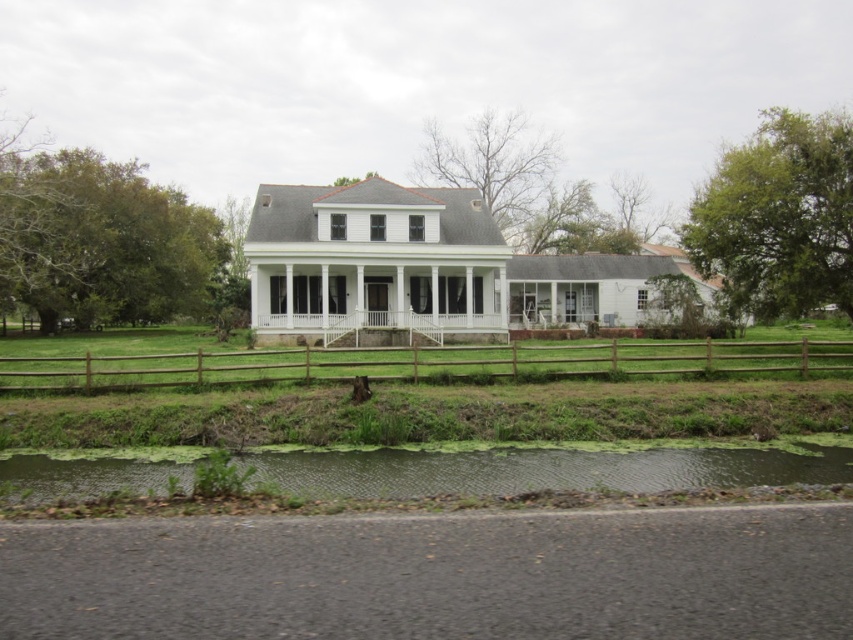
You are standing on the paved road in front of the house. You want to cross to the green algae covered pond at lower center. Is the point at coordinates point (538, 470) the correct location to cross to reach the pond?

Yes, the point at coordinates point (538, 470) is the correct location to cross to reach the green algae covered pond at lower center as the description states that the green algae covered pond at lower center is located at that point.